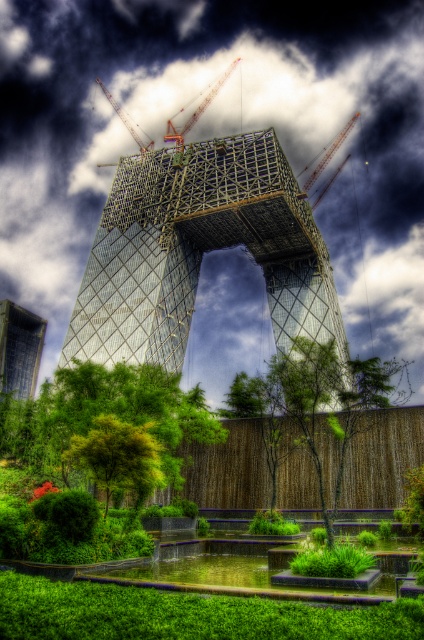
Can you confirm if orange metallic crane at upper center is positioned to the right of metallic red crane at upper center?

In fact, orange metallic crane at upper center is to the left of metallic red crane at upper center.

Can you confirm if orange metallic crane at upper center is smaller than metallic red crane at upper center?

Actually, orange metallic crane at upper center might be larger than metallic red crane at upper center.

In order to click on orange metallic crane at upper center in this screenshot , I will do `click(197, 109)`.

Which is above, white fluffy cloud at upper center or green leafy tree at center?

white fluffy cloud at upper center is higher up.

Which is behind, point (371, 13) or point (332, 518)?

Positioned behind is point (371, 13).

Is point (92, 140) more distant than point (290, 387)?

Yes, point (92, 140) is behind point (290, 387).

Where is `white fluffy cloud at upper center`? white fluffy cloud at upper center is located at coordinates (217, 134).

Does white fluffy cloud at upper center appear on the left side of orange metallic crane at upper center?

No, white fluffy cloud at upper center is not to the left of orange metallic crane at upper center.

In the scene shown: Is white fluffy cloud at upper center smaller than orange metallic crane at upper center?

Actually, white fluffy cloud at upper center might be larger than orange metallic crane at upper center.

Identify the location of white fluffy cloud at upper center. (217, 134).

Locate an element on the screen. white fluffy cloud at upper center is located at coordinates pyautogui.click(x=217, y=134).